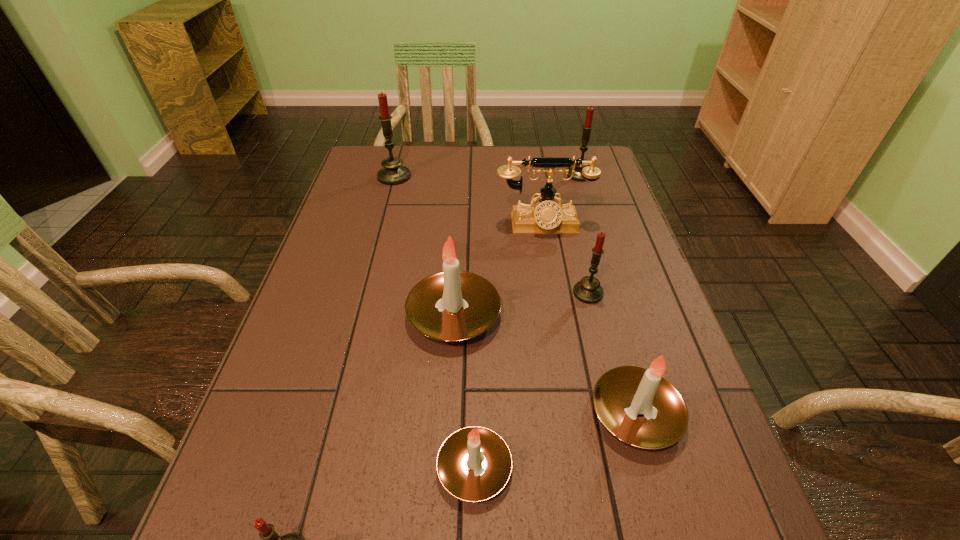
This screenshot has width=960, height=540. I want to click on the tallest object, so click(393, 173).

The height and width of the screenshot is (540, 960). Identify the location of the biggest red candle. (393, 173).

The height and width of the screenshot is (540, 960). In order to click on the second biggest red candle in this screenshot , I will do 587,127.

The image size is (960, 540). In order to click on the farthest white candle in this screenshot , I will do `click(453, 305)`.

Where is `beige telephone`? This screenshot has width=960, height=540. beige telephone is located at coordinates (546, 217).

Where is `telephone`? This screenshot has height=540, width=960. telephone is located at coordinates (546, 217).

Image resolution: width=960 pixels, height=540 pixels. Identify the location of the second nearest red candle. (588, 290).

Locate an element on the screen. This screenshot has width=960, height=540. the second biggest white candle is located at coordinates (620, 394).

The image size is (960, 540). I want to click on the smallest white candle, so click(458, 464).

Where is `vacant space situated on the right of the tallest candle`? The image size is (960, 540). vacant space situated on the right of the tallest candle is located at coordinates (x=476, y=177).